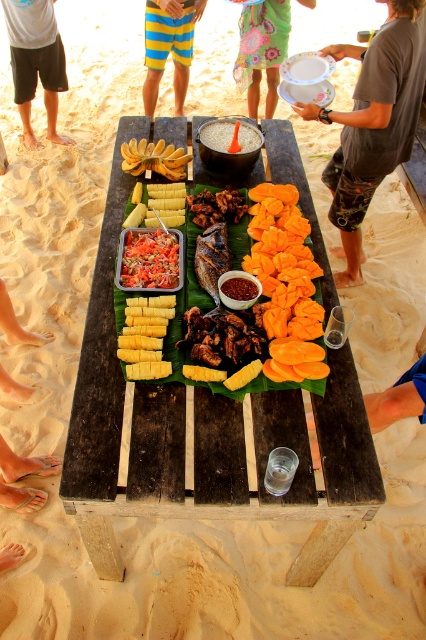
At what (x,y) coordinates should I click in order to perform the action: click on yellow corn at center. Please return your answer as a coordinate pair (x, y). The width and height of the screenshot is (426, 640). Looking at the image, I should click on (146, 337).

Between yellow corn at center and yellow matte bananas at upper left, which one is positioned higher?

yellow matte bananas at upper left is higher up.

Find the location of `yellow corn at center`. yellow corn at center is located at coordinates (146, 337).

The width and height of the screenshot is (426, 640). What are the coordinates of `yellow corn at center` in the screenshot? It's located at (146, 337).

Can you confirm if yellow matte pineapple at center is shorter than red chili paste at center?

No, yellow matte pineapple at center is not shorter than red chili paste at center.

The width and height of the screenshot is (426, 640). Describe the element at coordinates (216, 342) in the screenshot. I see `yellow matte pineapple at center` at that location.

The image size is (426, 640). What are the coordinates of `yellow matte pineapple at center` in the screenshot? It's located at (216, 342).

Can you confirm if yellow crispy chips at center is positioned to the right of yellow corn at center?

Correct, you'll find yellow crispy chips at center to the right of yellow corn at center.

Between yellow crispy chips at center and yellow corn at center, which one is positioned lower?

Positioned lower is yellow corn at center.

Locate an element on the screen. The image size is (426, 640). yellow crispy chips at center is located at coordinates (285, 284).